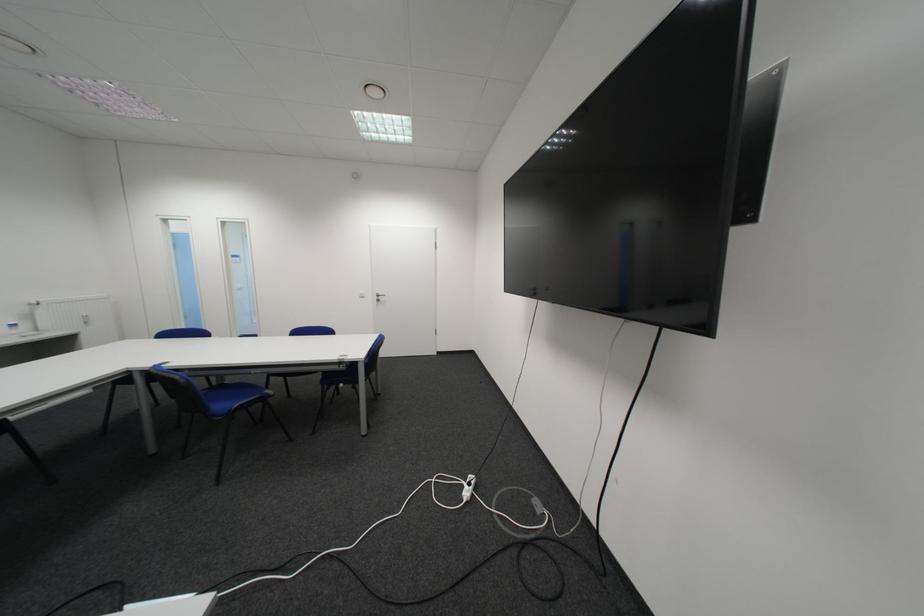
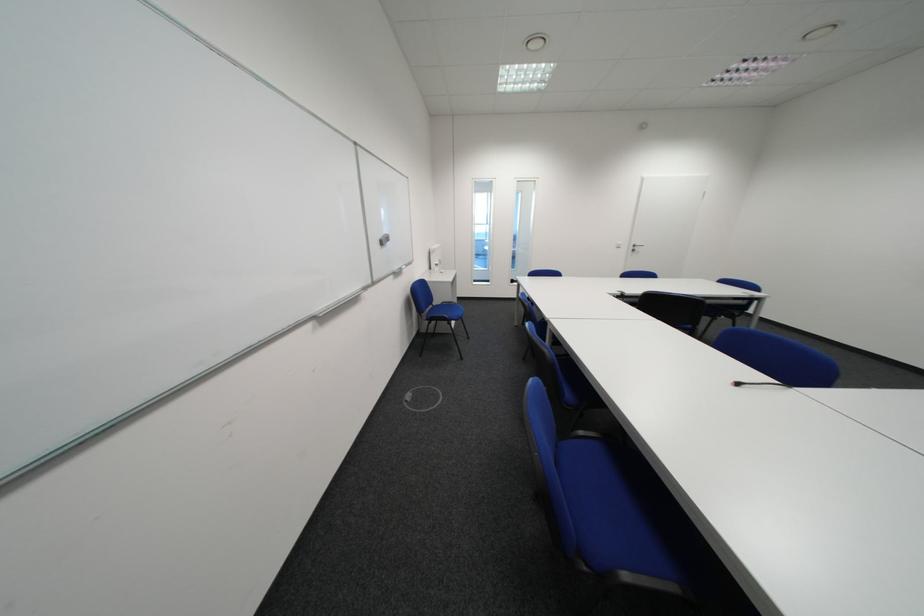
Question: Which direction would the cameraman need to move to produce the second image? Reply with the corresponding letter.

Choices:
 (A) Left
 (B) Right
 (C) Forward
 (D) Backward

Answer: (A)